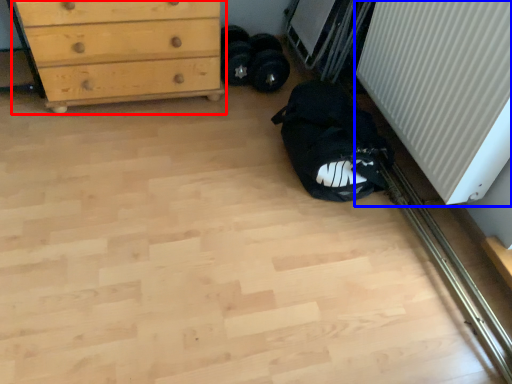
Question: Which of the following is the farthest to the observer, chest of drawers (highlighted by a red box) or radiator (highlighted by a blue box)?

Choices:
 (A) chest of drawers
 (B) radiator

Answer: (A)